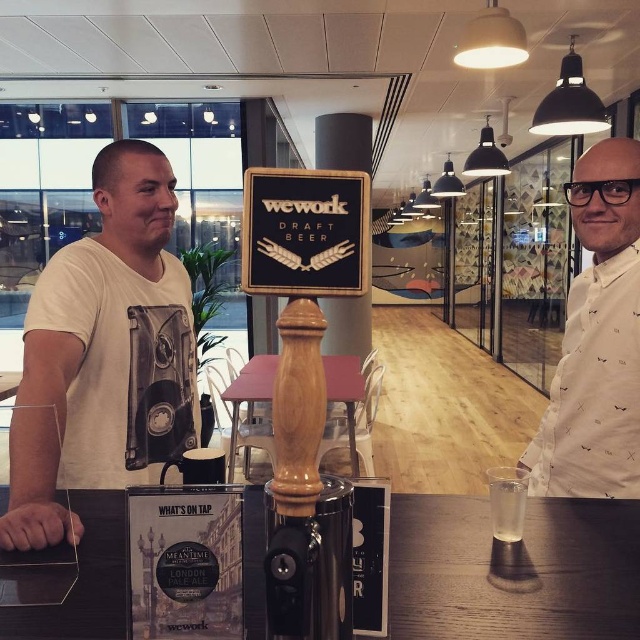
You are standing at the counter in the image. There is a point located at coordinates (596, 340). Which object from the scene does this point belong to?

The point at coordinates (596, 340) is on the white shirt at right with small black patterns.